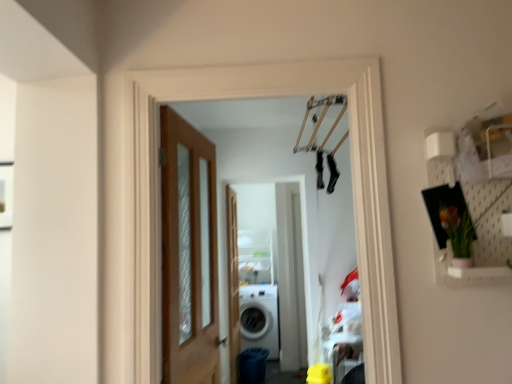
Question: Is white glossy washing machine at center positioned beyond the bounds of wooden door at left?

Choices:
 (A) yes
 (B) no

Answer: (A)

Question: Is white glossy washing machine at center behind wooden door at left?

Choices:
 (A) no
 (B) yes

Answer: (B)

Question: From a real-world perspective, is white glossy washing machine at center positioned under wooden door at left based on gravity?

Choices:
 (A) no
 (B) yes

Answer: (B)

Question: From the image's perspective, does white glossy washing machine at center appear lower than wooden door at left?

Choices:
 (A) no
 (B) yes

Answer: (B)

Question: Is wooden door at left at the back of white glossy washing machine at center?

Choices:
 (A) no
 (B) yes

Answer: (A)

Question: Is white glossy washing machine at center thinner than wooden door at left?

Choices:
 (A) no
 (B) yes

Answer: (A)

Question: Can you confirm if wooden door at left is bigger than white glossy washing machine at center?

Choices:
 (A) no
 (B) yes

Answer: (A)

Question: Is wooden door at left turned away from white glossy washing machine at center?

Choices:
 (A) no
 (B) yes

Answer: (A)

Question: From a real-world perspective, is wooden door at left located beneath white glossy washing machine at center?

Choices:
 (A) no
 (B) yes

Answer: (A)

Question: Is wooden door at left shorter than white glossy washing machine at center?

Choices:
 (A) yes
 (B) no

Answer: (B)

Question: Considering the relative positions of wooden door at left and white glossy washing machine at center in the image provided, is wooden door at left to the left of white glossy washing machine at center from the viewer's perspective?

Choices:
 (A) no
 (B) yes

Answer: (B)

Question: From a real-world perspective, is wooden door at left over white glossy washing machine at center?

Choices:
 (A) no
 (B) yes

Answer: (B)

Question: Considering the relative sizes of wooden door at left and clear wood screen door at center in the image provided, is wooden door at left smaller than clear wood screen door at center?

Choices:
 (A) yes
 (B) no

Answer: (B)